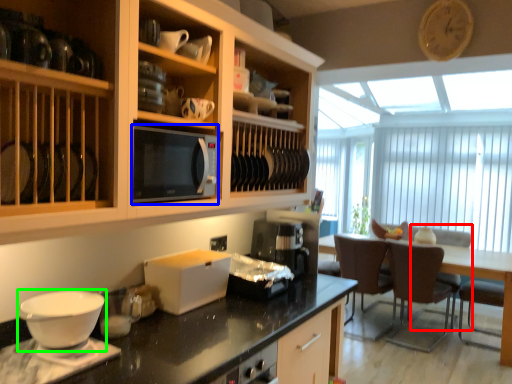
Question: Estimate the real-world distances between objects in this image. Which object is closer to armchair (highlighted by a red box), microwave oven (highlighted by a blue box) or coffee cup (highlighted by a green box)?

Choices:
 (A) microwave oven
 (B) coffee cup

Answer: (A)